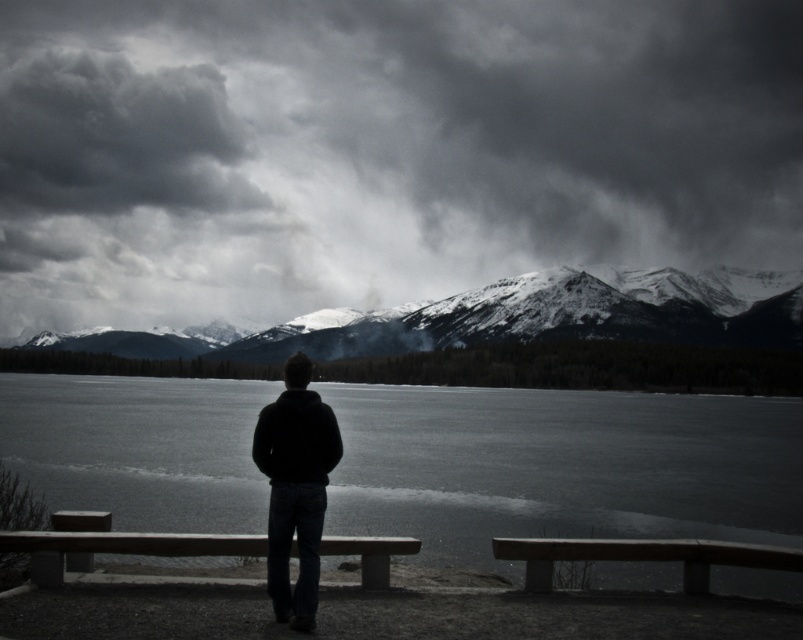
You are an architect designing a new observatory that needs to have a clear view of the dark gray fluffy cloud at upper left and the wooden bench at lower center. Given their sizes, which object would require a larger window to ensure it can be fully viewed from inside the observatory?

The dark gray fluffy cloud at upper left requires a larger window because it has a larger size compared to the wooden bench at lower center.